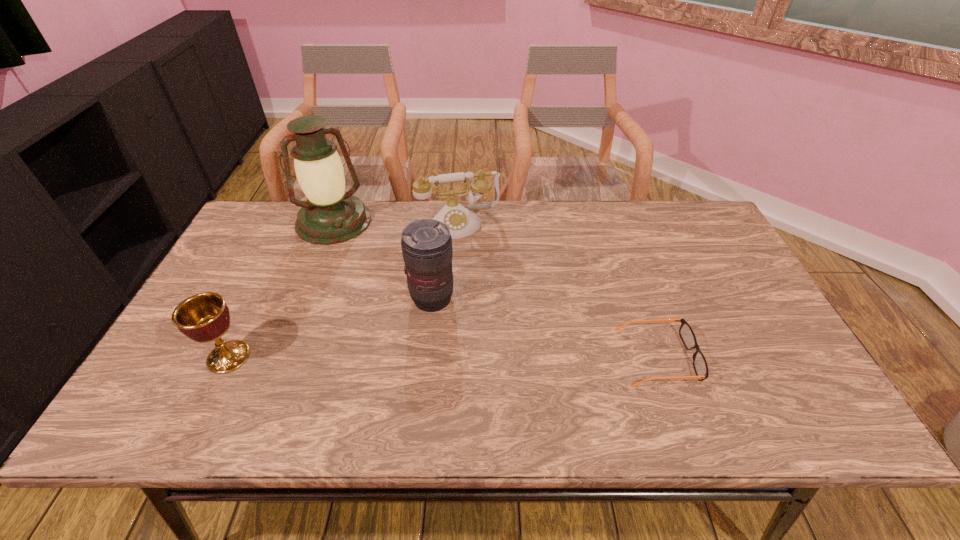
Identify the location of chalice. (204, 317).

This screenshot has width=960, height=540. I want to click on the shortest object, so click(686, 333).

The image size is (960, 540). What are the coordinates of `spectacles` in the screenshot? It's located at (686, 333).

At what (x,y) coordinates should I click in order to perform the action: click on telephoto lens. Please return your answer as a coordinate pair (x, y). Looking at the image, I should click on (426, 244).

This screenshot has width=960, height=540. Find the location of `the second tallest object`. the second tallest object is located at coordinates (426, 244).

Where is `telephone`? The image size is (960, 540). telephone is located at coordinates (461, 222).

I want to click on lantern, so click(x=331, y=216).

Find the location of `blank area located on the back of the chalice`. blank area located on the back of the chalice is located at coordinates (264, 285).

The width and height of the screenshot is (960, 540). Identify the location of vacant area situated on the front-facing side of the spectacles. (770, 357).

At what (x,y) coordinates should I click in order to perform the action: click on free space located on the side of the telephoto lens where the control switches are located. Please return your answer as a coordinate pair (x, y). Looking at the image, I should click on (467, 338).